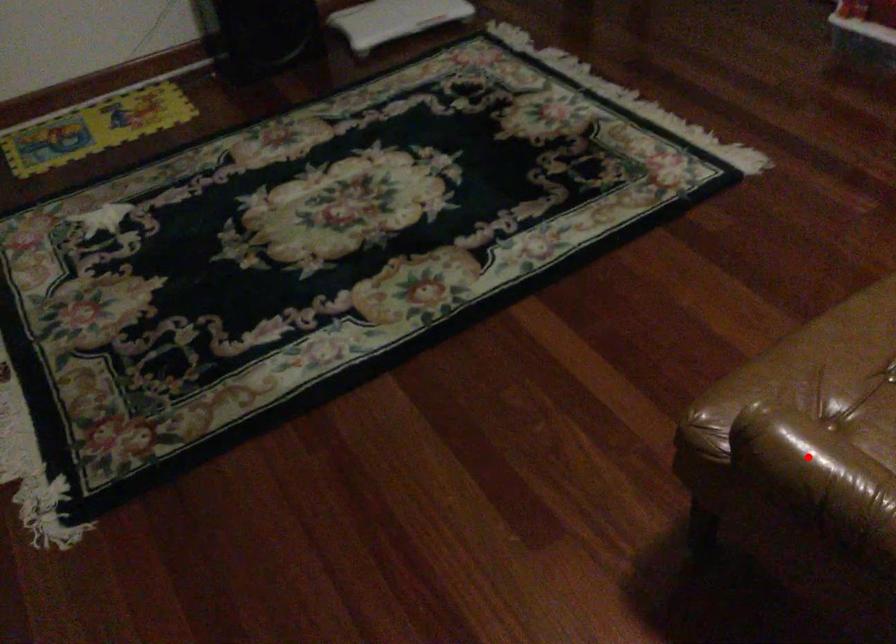
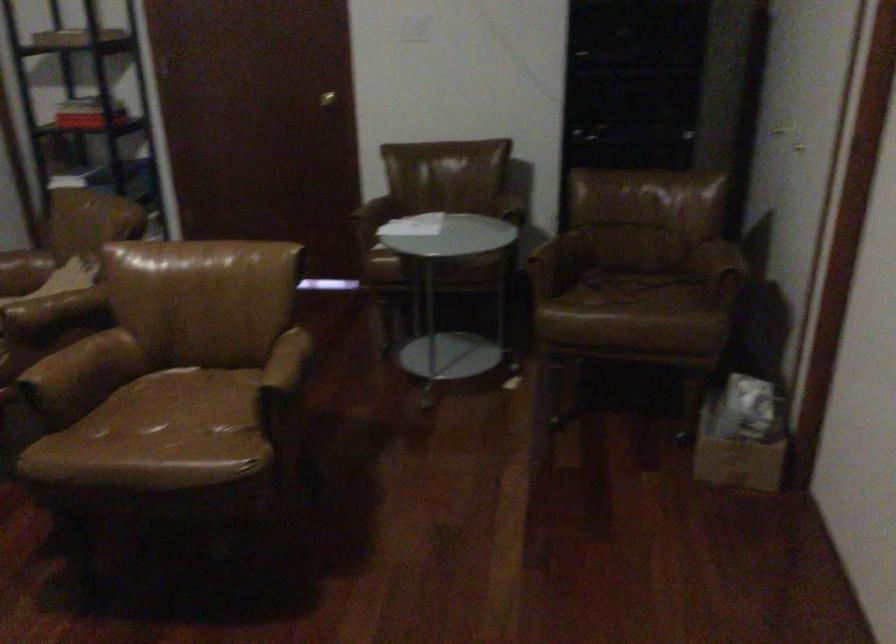
Question: I am providing you with two images of the same scene from different viewpoints. A red point is shown in image1. For the corresponding object point in image2, is it positioned nearer or farther from the camera?

Choices:
 (A) Nearer
 (B) Farther

Answer: (B)